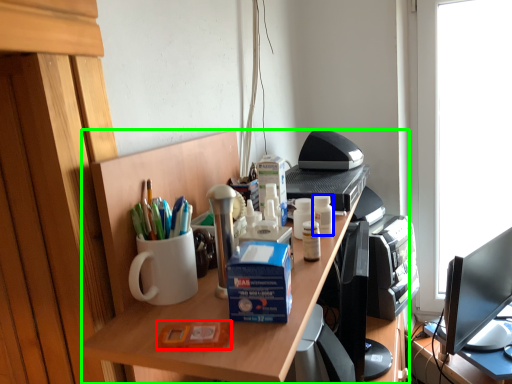
Question: Based on their relative distances, which object is nearer to stationery (highlighted by a red box)? Choose from stationery (highlighted by a blue box) and desk (highlighted by a green box).

Choices:
 (A) stationery
 (B) desk

Answer: (B)